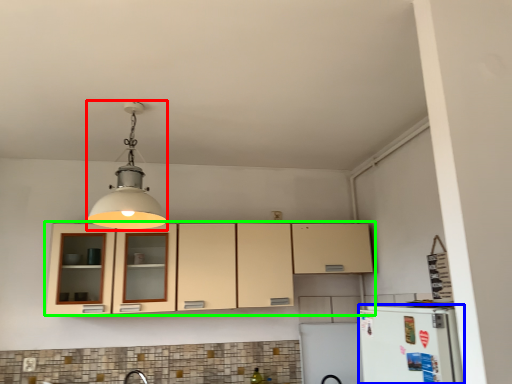
Question: Considering the real-world distances, which object is closest to light fixture (highlighted by a red box)? appliance (highlighted by a blue box) or cabinetry (highlighted by a green box).

Choices:
 (A) appliance
 (B) cabinetry

Answer: (B)